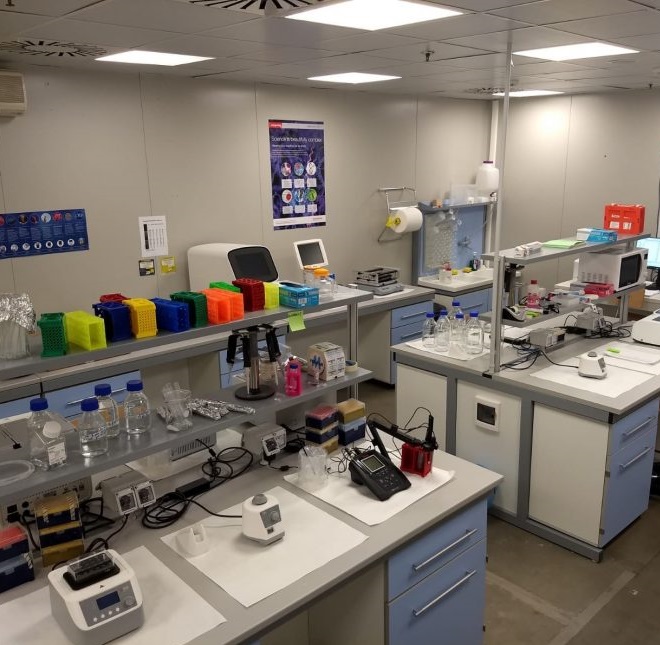
Where is `drawer pulls`? drawer pulls is located at coordinates (430, 566), (444, 593), (636, 460), (629, 431).